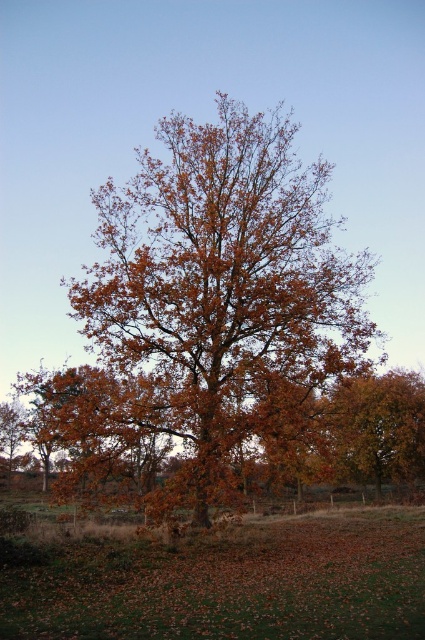
Is orange-brown wood oak tree at center smaller than orange-brown leaves at center?

No, orange-brown wood oak tree at center is not smaller than orange-brown leaves at center.

Who is more distant from viewer, (261,156) or (377,436)?

Point (377,436)

Where is `orange-brown wood oak tree at center`? The image size is (425, 640). orange-brown wood oak tree at center is located at coordinates (212, 308).